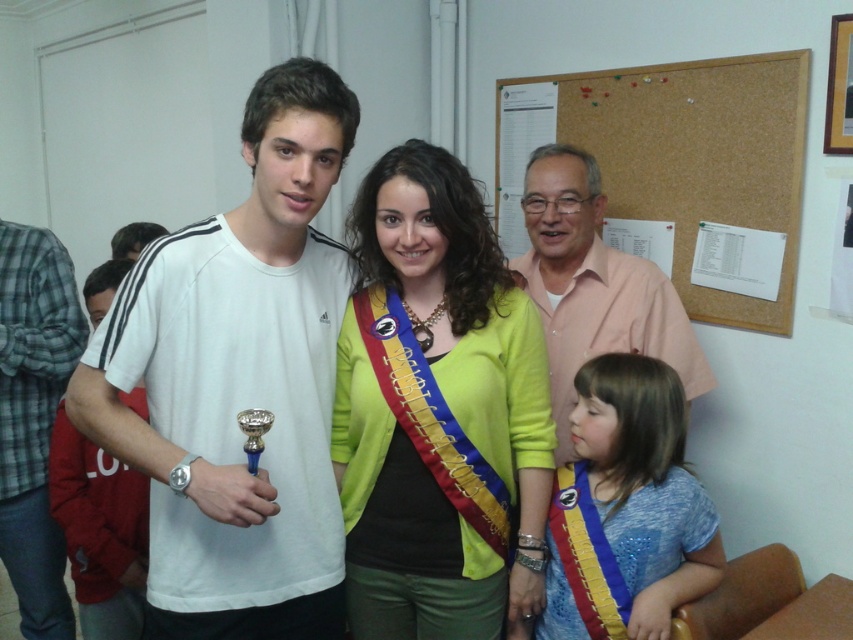
You are at an event and see two sashes, the green fabric sash at center and the blue satin sash at lower right. Which one is located more to the left?

The green fabric sash at center is more to the left than the blue satin sash at lower right.